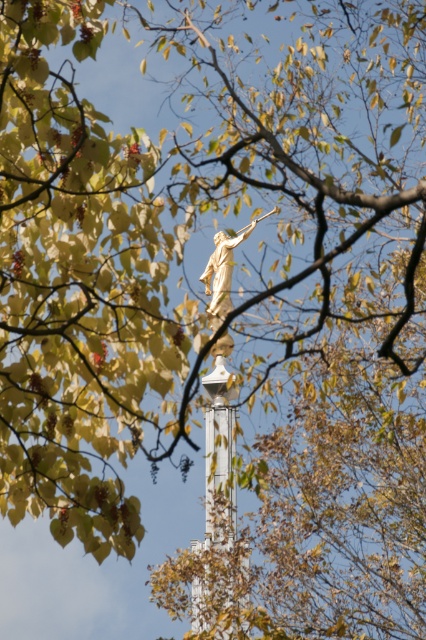
Is white glossy tower at center smaller than gold metallic statue at center?

No.

Find the location of a particular element. This screenshot has height=640, width=426. white glossy tower at center is located at coordinates point(218,508).

You are a GUI agent. You are given a task and a screenshot of the screen. Output one action in this format:
    pyautogui.click(x=<x>, y=<y>)
    Task: Click on the white glossy tower at center
    The height and width of the screenshot is (640, 426).
    Given the screenshot: What is the action you would take?
    pyautogui.click(x=218, y=508)